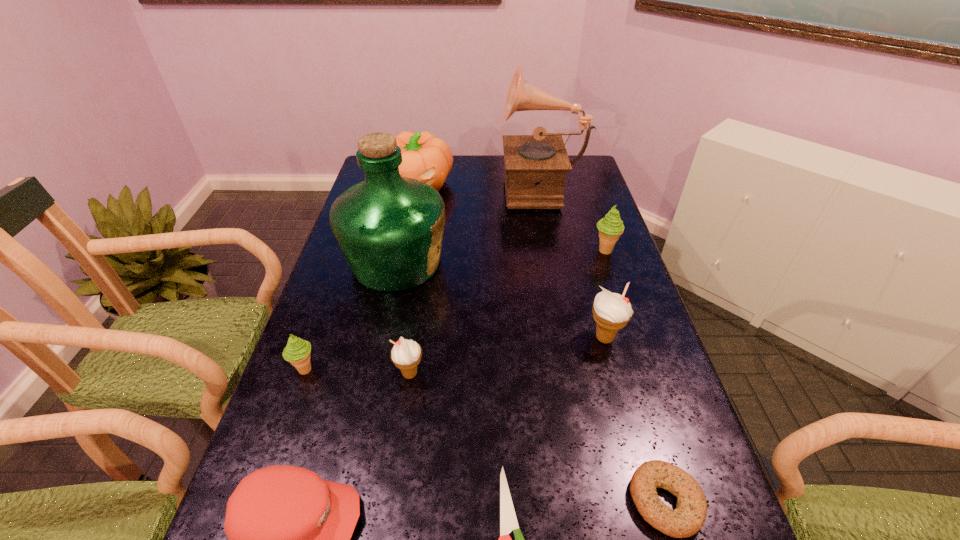
The height and width of the screenshot is (540, 960). Identify the location of blank space that satisfies the following two spatial constraints: 1. on the carved face of the pumpkin; 2. on the right side of the left white icecream. (377, 374).

Where is `free space in the image that satisfies the following two spatial constraints: 1. on the label side of the liquor; 2. on the right side of the third icecream from right to left`? This screenshot has height=540, width=960. free space in the image that satisfies the following two spatial constraints: 1. on the label side of the liquor; 2. on the right side of the third icecream from right to left is located at coordinates (372, 374).

This screenshot has width=960, height=540. I want to click on vacant space that satisfies the following two spatial constraints: 1. on the label side of the left white icecream; 2. on the left side of the green liquor, so click(372, 374).

Locate an element on the screen. vacant area that satisfies the following two spatial constraints: 1. on the carved face of the eighth shortest object; 2. on the left side of the bigger green icecream is located at coordinates point(403,251).

The width and height of the screenshot is (960, 540). I want to click on vacant space that satisfies the following two spatial constraints: 1. on the carved face of the eighth shortest object; 2. on the left side of the nearer white icecream, so click(377, 374).

This screenshot has width=960, height=540. Identify the location of free space that satisfies the following two spatial constraints: 1. on the label side of the smaller white icecream; 2. on the left side of the liquor. (372, 374).